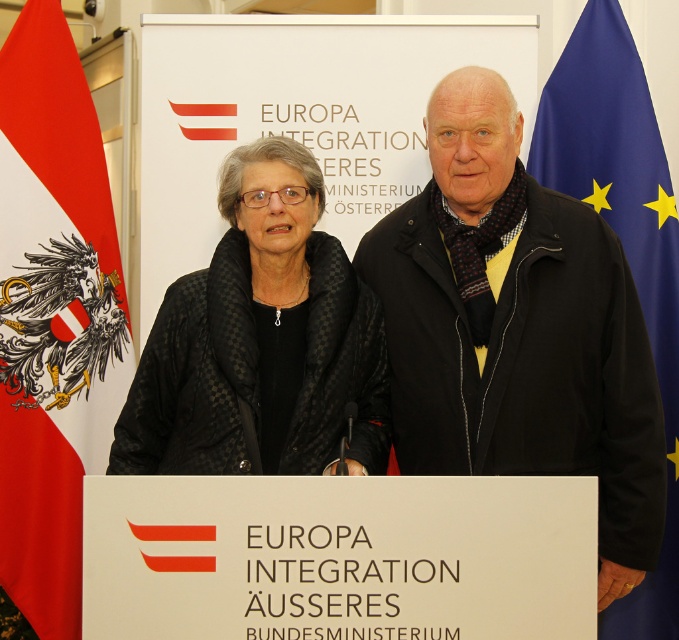
Consider the image. You are an event organizer who needs to ensure that all items on stage are visible to the audience. Given the black matte jacket at center and the blue fabric flag at center, which item might be partially obscured if placed directly behind the other?

The black matte jacket at center has a lesser height compared to the blue fabric flag at center. Therefore, if the jacket is placed behind the flag, it might be partially obscured by the taller flag.

You are standing in front of the podium at the event. There are two points marked in the image. Which point is closer to you, point (538,301) or point (191,381)?

Point (538,301) is closer to you because it is further to the viewer than point (191,381).